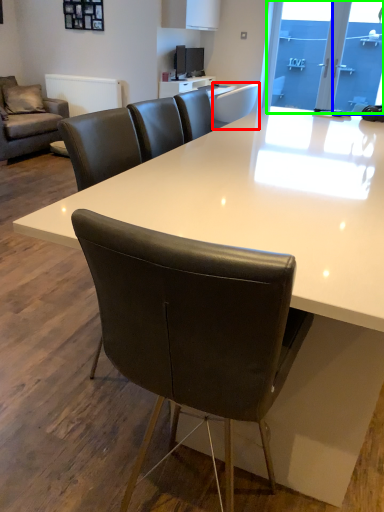
Question: Estimate the real-world distances between objects in this image. Which object is closer to chair (highlighted by a red box), glass door (highlighted by a blue box) or window screen (highlighted by a green box)?

Choices:
 (A) glass door
 (B) window screen

Answer: (B)